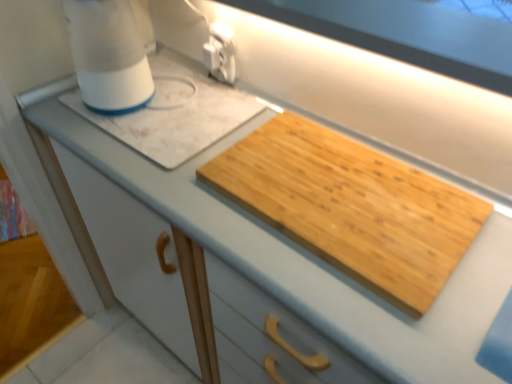
You are a GUI agent. You are given a task and a screenshot of the screen. Output one action in this format:
    pyautogui.click(x=<x>, y=<y>)
    Task: Click on the vacant space in front of white plastic electric outlet at upper center
    
    Given the screenshot: What is the action you would take?
    click(211, 116)